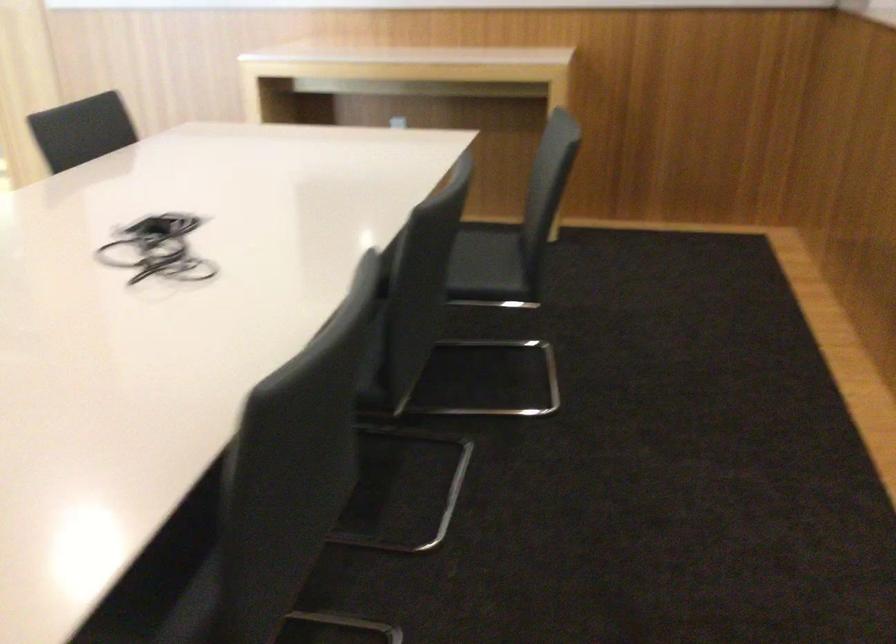
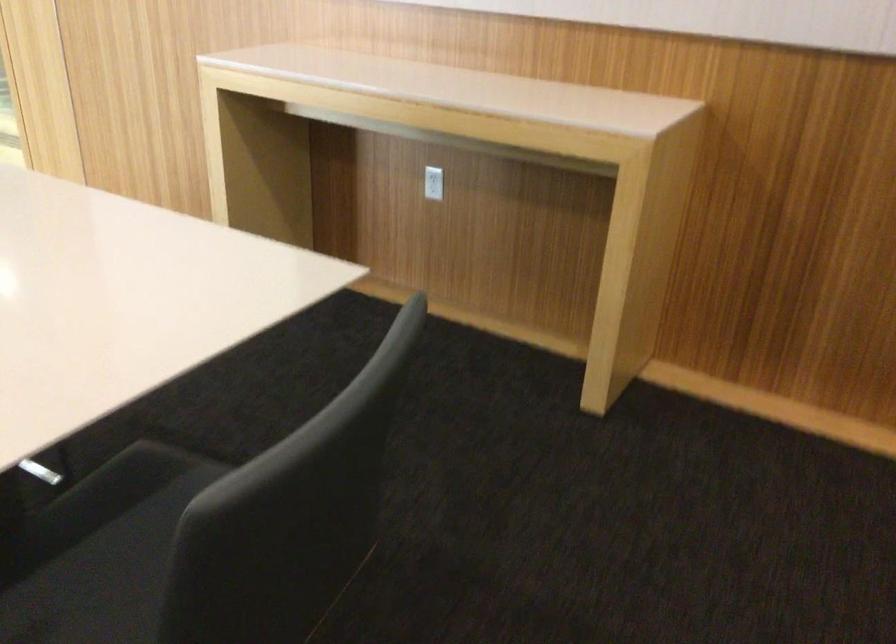
The images are taken continuously from a first-person perspective. In which direction are you moving?

The movement direction of the cameraman is right, forward.